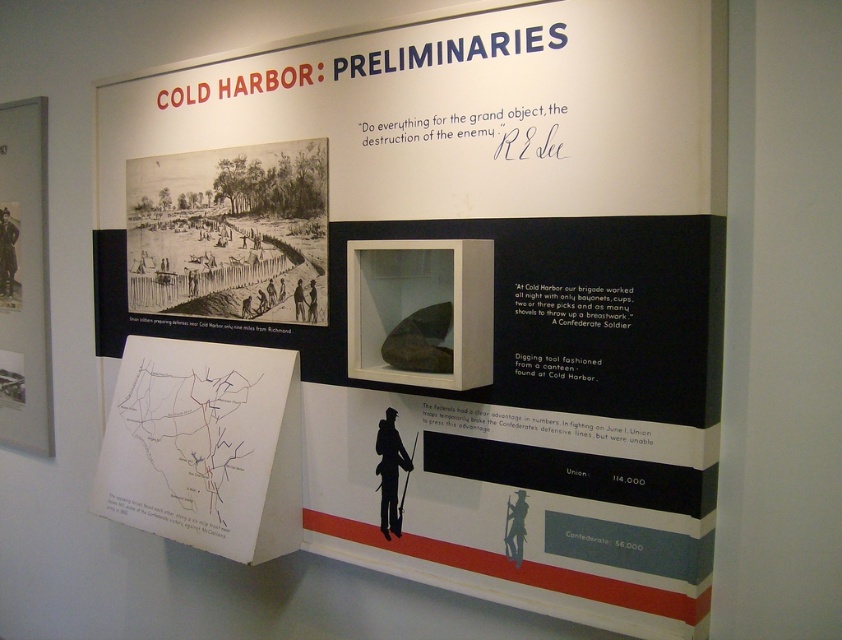
You are a history student visiting the museum and notice the white paper map at lower left and the black paper at upper left on the exhibit panel. Which one is located higher up on the panel?

The black paper at upper left is higher up on the panel than the white paper map at lower left.

You are a museum visitor standing in front of the exhibit panel. You notice the black paper at upper left and the matte paper map at left. Which of these two objects is taller?

The matte paper map at left is taller than the black paper at upper left.

You are a museum visitor standing in front of the exhibit panel about the Cold Harbor campaign. You notice two points marked on the panel. The first point is at coordinates point (206, 410) and the second is at point (198, 202). Which of these points is closer to you as you face the panel?

Point (206, 410) is in front of point (198, 202), so it is closer to you as you face the panel.